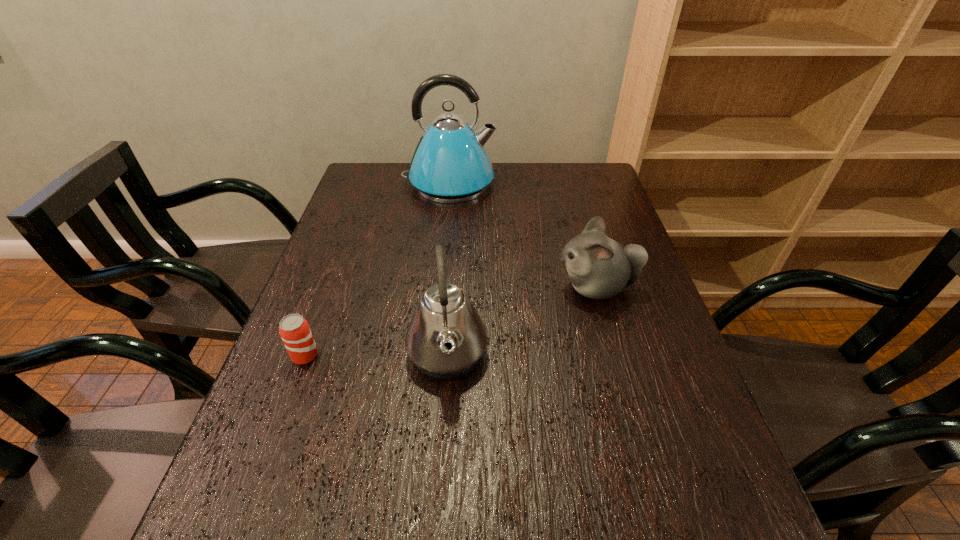
Image resolution: width=960 pixels, height=540 pixels. I want to click on free spot between the taller kettle and the nearer kettle, so click(x=448, y=269).

Find the location of a particular element. vacant space in between the beer can and the tallest object is located at coordinates (377, 270).

Select which object is the third closest to the rightmost object. Please provide its 2D coordinates. Your answer should be formatted as a tuple, i.e. [(x, y)], where the tuple contains the x and y coordinates of a point satisfying the conditions above.

[(294, 330)]

Identify which object is located as the second nearest to the third shortest object. Please provide its 2D coordinates. Your answer should be formatted as a tuple, i.e. [(x, y)], where the tuple contains the x and y coordinates of a point satisfying the conditions above.

[(294, 330)]

The image size is (960, 540). Find the location of `free space in the image that satisfies the following two spatial constraints: 1. on the back side of the third shortest object; 2. at the spout of the farther kettle`. free space in the image that satisfies the following two spatial constraints: 1. on the back side of the third shortest object; 2. at the spout of the farther kettle is located at coordinates (459, 184).

The image size is (960, 540). In order to click on vacant region that satisfies the following two spatial constraints: 1. on the back side of the third shortest object; 2. at the spout of the tallest object in this screenshot , I will do `click(459, 184)`.

Find the location of a particular element. vacant space that satisfies the following two spatial constraints: 1. at the spout of the farthest object; 2. on the left side of the second tallest object is located at coordinates (432, 355).

Where is `vacant space that satisfies the following two spatial constraints: 1. on the face of the hamster; 2. on the front side of the shorter kettle`? The width and height of the screenshot is (960, 540). vacant space that satisfies the following two spatial constraints: 1. on the face of the hamster; 2. on the front side of the shorter kettle is located at coordinates pos(615,355).